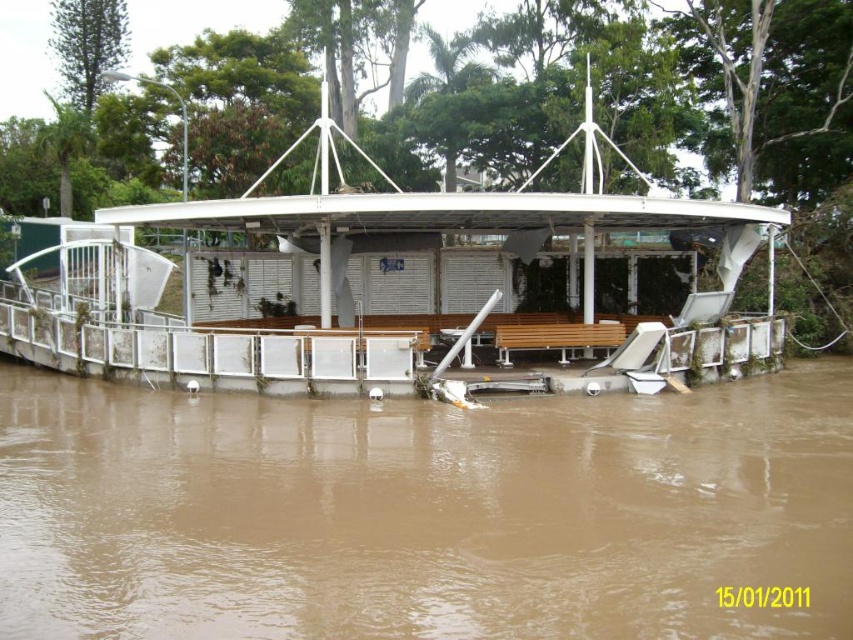
Question: Can you confirm if brown matte wood at center is smaller than white matte boat at center?

Choices:
 (A) yes
 (B) no

Answer: (A)

Question: Estimate the real-world distances between objects in this image. Which object is farther from the wooden bench at center?

Choices:
 (A) white matte boat at center
 (B) brown matte wood at center

Answer: (B)

Question: Which is nearer to the white matte boat at center?

Choices:
 (A) wooden bench at center
 (B) brown matte wood at center

Answer: (B)

Question: Which point is closer to the camera?

Choices:
 (A) coord(845,381)
 (B) coord(645,332)

Answer: (B)

Question: Does brown matte wood at center appear over white matte boat at center?

Choices:
 (A) no
 (B) yes

Answer: (A)

Question: Is brown matte wood at center smaller than white matte boat at center?

Choices:
 (A) yes
 (B) no

Answer: (A)